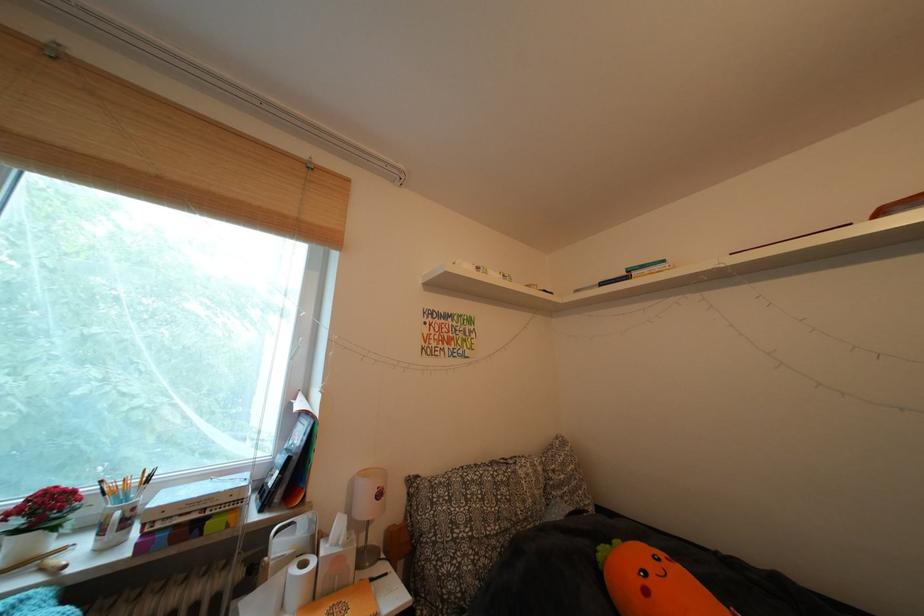
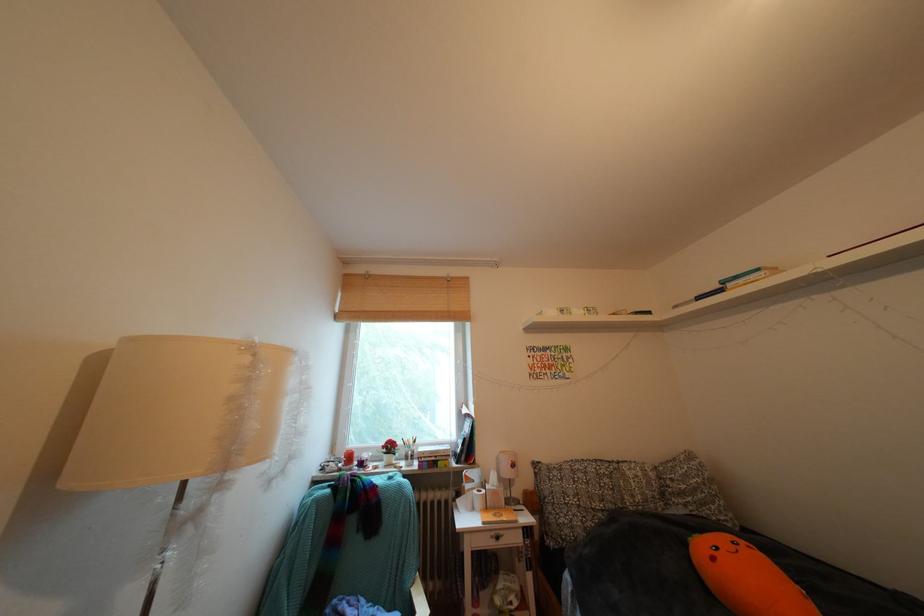
Locate, in the second image, the point that corresponds to [287,487] in the first image.

(472, 456)